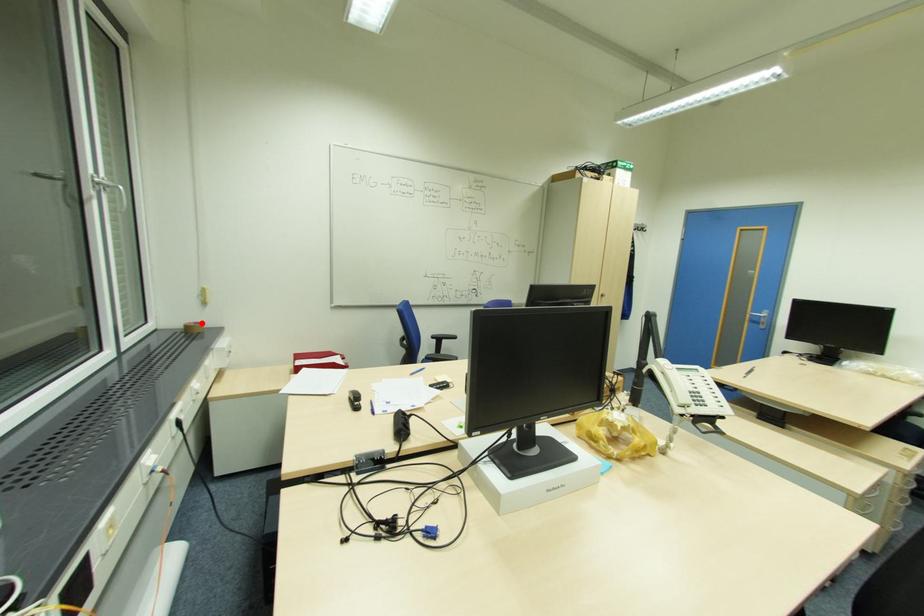
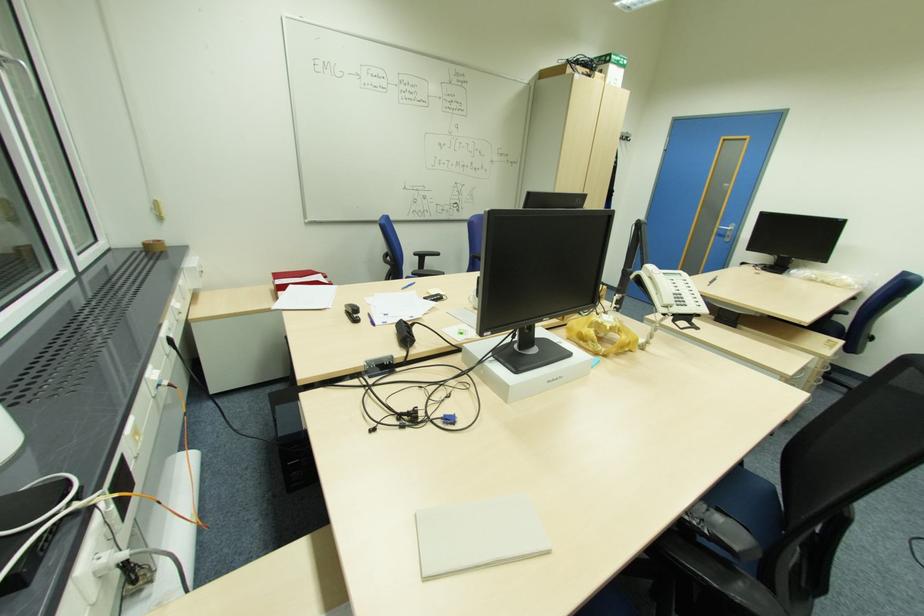
The point at the highlighted location is marked in the first image. Where is the corresponding point in the second image?

(162, 241)